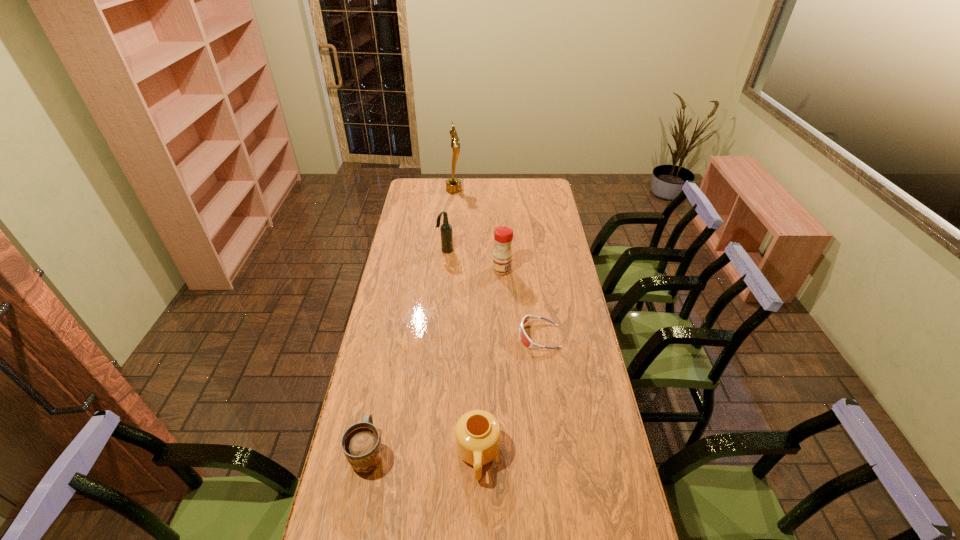
Locate an element on the screen. The image size is (960, 540). free point between the tallest object and the fifth nearest object is located at coordinates (449, 220).

The image size is (960, 540). Identify the location of empty location between the right mug and the fourth nearest object. (490, 363).

The height and width of the screenshot is (540, 960). I want to click on vacant area that lies between the right mug and the tallest object, so click(x=466, y=322).

What are the coordinates of `vacant area that lies between the third farthest object and the tallest object` in the screenshot? It's located at (478, 230).

Point out which object is positioned as the fourth nearest to the third farthest object. Please provide its 2D coordinates. Your answer should be formatted as a tuple, i.e. [(x, y)], where the tuple contains the x and y coordinates of a point satisfying the conditions above.

[(477, 432)]

Find the location of a particular element. The width and height of the screenshot is (960, 540). object identified as the third closest to the beer bottle is located at coordinates (524, 338).

What are the coordinates of `free space that satisfies the following two spatial constraints: 1. on the front-facing side of the award; 2. on the front side of the second farthest object` in the screenshot? It's located at (448, 251).

I want to click on free space that satisfies the following two spatial constraints: 1. on the side of the beer bottle with the handle; 2. on the right side of the leftmost object, so click(x=409, y=251).